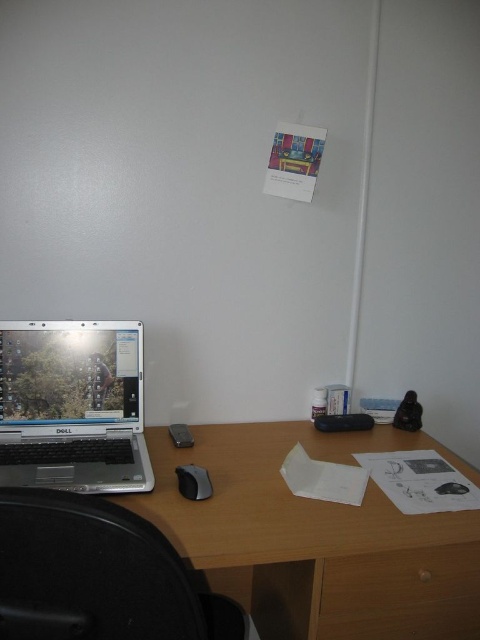
In the scene shown: You have a small toy car that is 10 cm long. You want to place it on the desk between the wooden at center and the black matte mouse at lower center. Can the toy car fit in that space?

The wooden at center is wider than the black matte mouse at lower center. However, the exact distance between them isn

You are organizing items on your desk and want to place a new item exactly at the center of the desk. However, there is already an object at point (316, 538). What is located at that point?

The wooden desk is located at point (316, 538).

You are standing 1.5 meters away from the desk. You want to reach the point at coordinates point (105, 444). Can you reach it without moving your position?

The distance of point (105, 444) from viewer is 1.33 meters, so yes, you can reach it without moving your position since you are only 1.5 meters away and the point is closer.